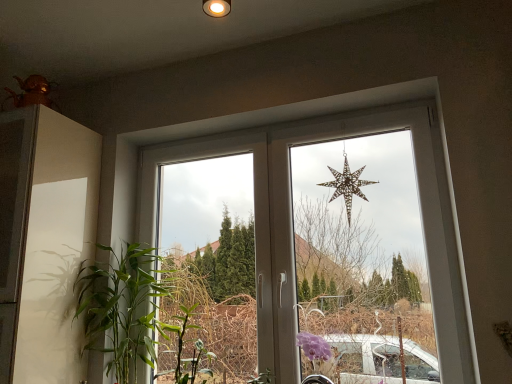
Question: From the image's perspective, does green leafy plant at left appear lower than metallic gold star at upper center?

Choices:
 (A) yes
 (B) no

Answer: (A)

Question: Can you confirm if green leafy plant at left is taller than metallic gold star at upper center?

Choices:
 (A) no
 (B) yes

Answer: (B)

Question: Can you confirm if green leafy plant at left is smaller than metallic gold star at upper center?

Choices:
 (A) yes
 (B) no

Answer: (B)

Question: From the image's perspective, is green leafy plant at left above metallic gold star at upper center?

Choices:
 (A) no
 (B) yes

Answer: (A)

Question: Is green leafy plant at left completely or partially outside of metallic gold star at upper center?

Choices:
 (A) yes
 (B) no

Answer: (A)

Question: From the image's perspective, relative to metallic gold star at upper center, is green leafy plant at left above or below?

Choices:
 (A) above
 (B) below

Answer: (B)

Question: From a real-world perspective, is green leafy plant at left positioned above or below metallic gold star at upper center?

Choices:
 (A) above
 (B) below

Answer: (B)

Question: Considering the positions of green leafy plant at left and metallic gold star at upper center in the image, is green leafy plant at left bigger or smaller than metallic gold star at upper center?

Choices:
 (A) big
 (B) small

Answer: (A)

Question: Visually, is green leafy plant at left positioned to the left or to the right of metallic gold star at upper center?

Choices:
 (A) right
 (B) left

Answer: (B)

Question: In terms of size, does metallic star at center appear bigger or smaller than green leafy plant at left?

Choices:
 (A) small
 (B) big

Answer: (B)

Question: Considering the positions of point (459, 302) and point (99, 327), is point (459, 302) closer or farther from the camera than point (99, 327)?

Choices:
 (A) farther
 (B) closer

Answer: (B)

Question: From a real-world perspective, is metallic star at center positioned above or below green leafy plant at left?

Choices:
 (A) above
 (B) below

Answer: (A)

Question: In terms of height, does metallic star at center look taller or shorter compared to green leafy plant at left?

Choices:
 (A) tall
 (B) short

Answer: (A)

Question: Considering the positions of metallic gold star at upper center and metallic star at center in the image, is metallic gold star at upper center bigger or smaller than metallic star at center?

Choices:
 (A) small
 (B) big

Answer: (A)

Question: Considering the positions of metallic gold star at upper center and metallic star at center in the image, is metallic gold star at upper center wider or thinner than metallic star at center?

Choices:
 (A) thin
 (B) wide

Answer: (A)